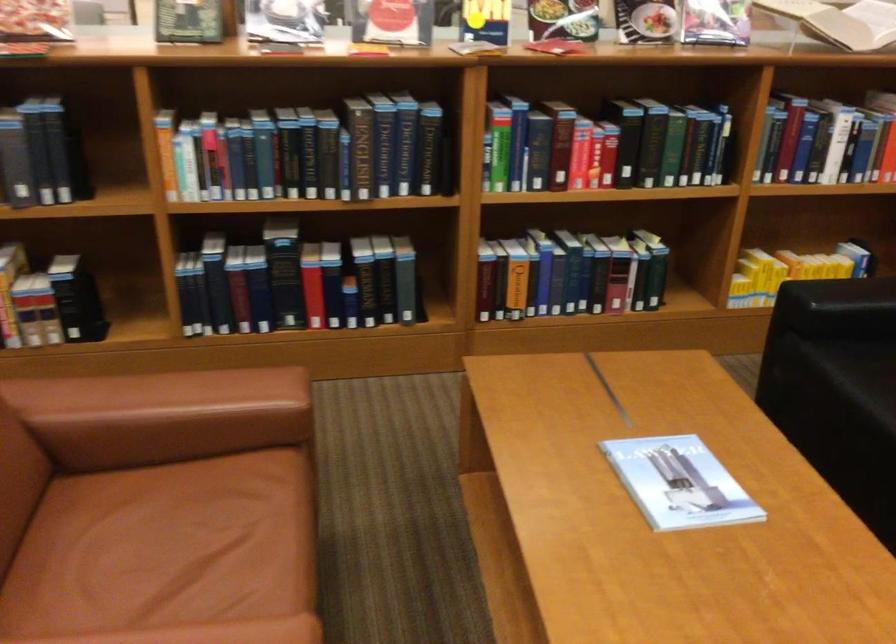
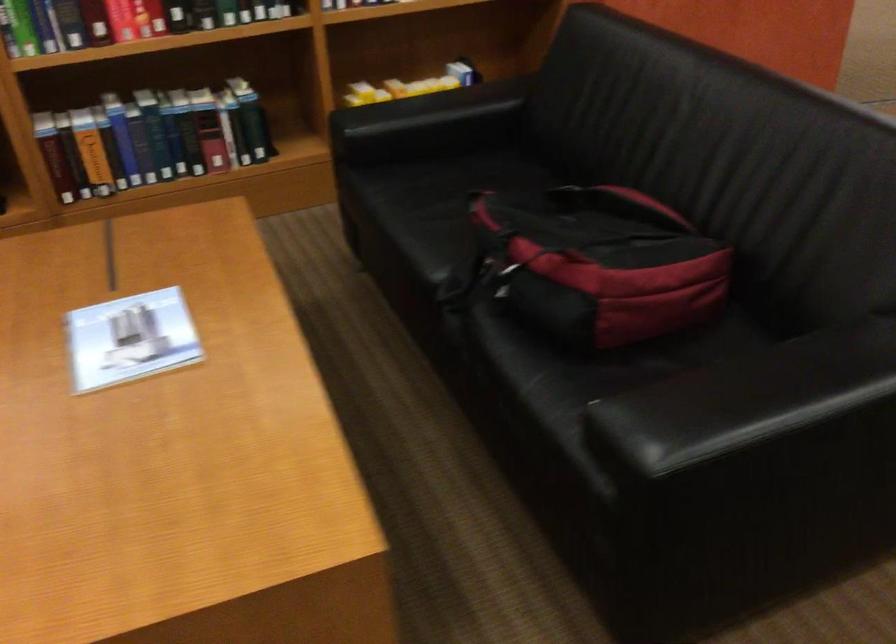
Locate, in the second image, the point that corresponds to (x=773, y=176) in the first image.

(350, 3)